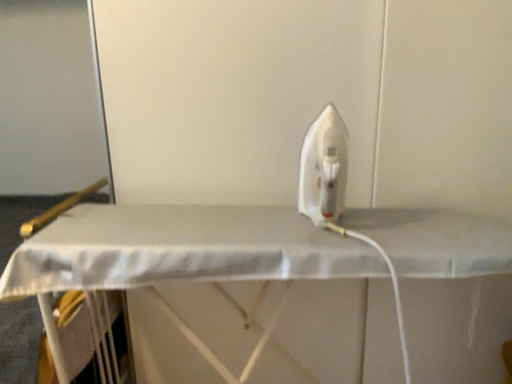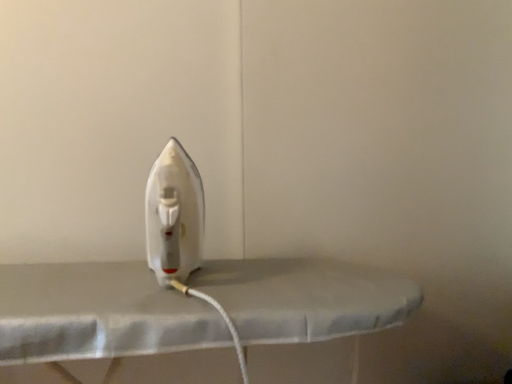
Question: How did the camera likely rotate when shooting the video?

Choices:
 (A) rotated downward
 (B) rotated upward

Answer: (B)